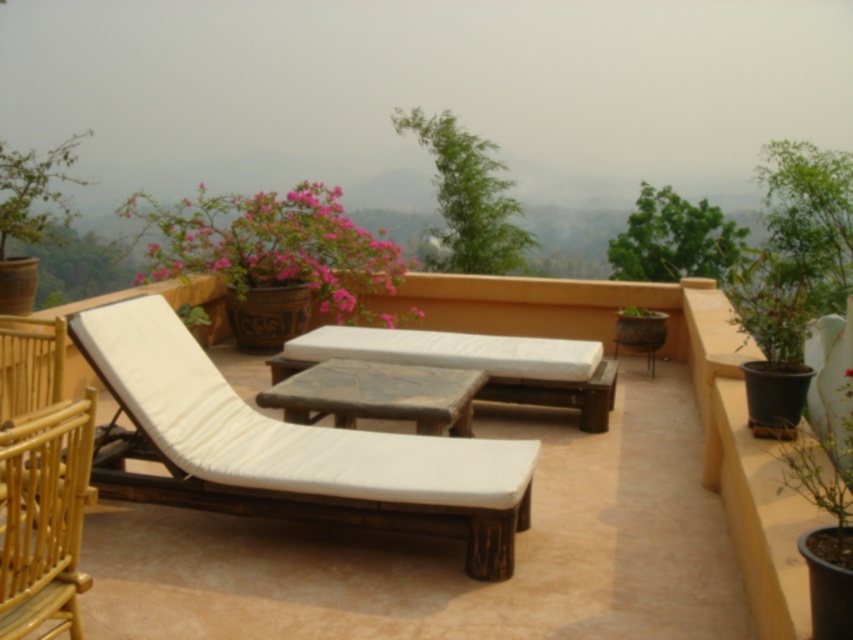
You are planning to place a tall plant in the pink matte flower pot at upper left. Considering the height of the white wood chaise lounge at center, will the plant in the flower pot be visible from someone sitting on the chaise lounge?

The white wood chaise lounge at center is shorter than the pink matte flower pot at upper left, so the plant in the flower pot will be visible from someone sitting on the chaise lounge.

You are standing at the point labeled as point (286, 196) on the rooftop terrace. You want to place a 10 feet long bench between the wooden chaise lounge with a white cushion and the woven bamboo chair with a light beige color. Is there enough space between them to fit the bench?

The distance between the wooden chaise lounge with a white cushion and the woven bamboo chair with a light beige color is 23.15 feet. Since the bench is 10 feet long, there is sufficient space to place it between them.